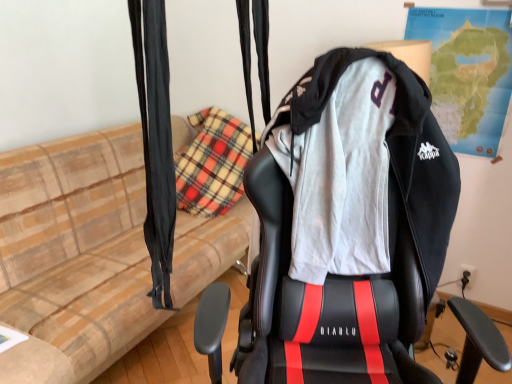
Question: Is the position of black leather gaming chair at center more distant than that of beige plaid couch at left?

Choices:
 (A) yes
 (B) no

Answer: (B)

Question: From a real-world perspective, does black leather gaming chair at center stand above beige plaid couch at left?

Choices:
 (A) yes
 (B) no

Answer: (A)

Question: Is black leather gaming chair at center taller than beige plaid couch at left?

Choices:
 (A) no
 (B) yes

Answer: (B)

Question: Is there a large distance between black leather gaming chair at center and beige plaid couch at left?

Choices:
 (A) yes
 (B) no

Answer: (A)

Question: From the image's perspective, is black leather gaming chair at center located beneath beige plaid couch at left?

Choices:
 (A) no
 (B) yes

Answer: (B)

Question: Is paper map at upper right in front of or behind beige plaid couch at left in the image?

Choices:
 (A) behind
 (B) front

Answer: (A)

Question: Considering the positions of paper map at upper right and beige plaid couch at left in the image, is paper map at upper right taller or shorter than beige plaid couch at left?

Choices:
 (A) short
 (B) tall

Answer: (A)

Question: Is paper map at upper right wider or thinner than beige plaid couch at left?

Choices:
 (A) thin
 (B) wide

Answer: (A)

Question: From a real-world perspective, is paper map at upper right above or below beige plaid couch at left?

Choices:
 (A) above
 (B) below

Answer: (A)

Question: In terms of height, does beige plaid couch at left look taller or shorter compared to paper map at upper right?

Choices:
 (A) tall
 (B) short

Answer: (A)

Question: Is beige plaid couch at left spatially inside paper map at upper right, or outside of it?

Choices:
 (A) outside
 (B) inside

Answer: (A)

Question: In the image, is beige plaid couch at left on the left side or the right side of paper map at upper right?

Choices:
 (A) left
 (B) right

Answer: (A)

Question: From a real-world perspective, is beige plaid couch at left physically located above or below paper map at upper right?

Choices:
 (A) above
 (B) below

Answer: (B)

Question: From a real-world perspective, is black leather gaming chair at center above or below black fabric curtain at left?

Choices:
 (A) above
 (B) below

Answer: (B)

Question: From the image's perspective, is black leather gaming chair at center positioned above or below black fabric curtain at left?

Choices:
 (A) above
 (B) below

Answer: (B)